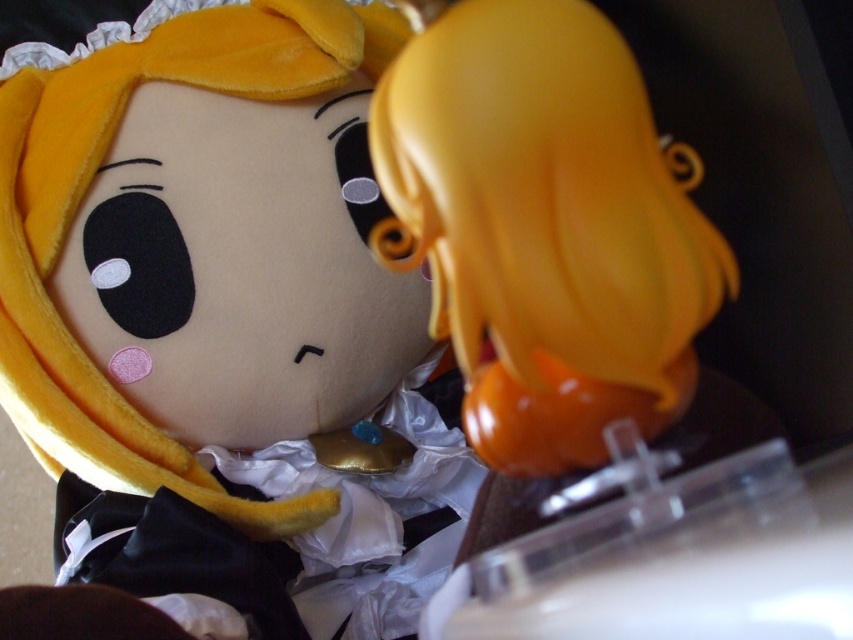
Question: Does velvet yellow plush toy at upper center have a larger size compared to matte orange figurine at center?

Choices:
 (A) yes
 (B) no

Answer: (A)

Question: Does velvet yellow plush toy at upper center have a larger size compared to matte orange figurine at center?

Choices:
 (A) yes
 (B) no

Answer: (A)

Question: Is velvet yellow plush toy at upper center closer to camera compared to matte orange figurine at center?

Choices:
 (A) yes
 (B) no

Answer: (B)

Question: Which point appears closest to the camera in this image?

Choices:
 (A) (323, 442)
 (B) (438, 67)

Answer: (B)